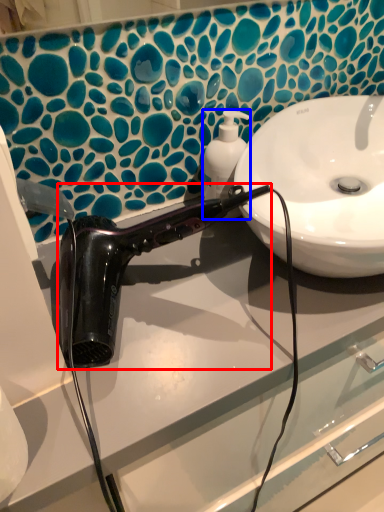
Question: Among these objects, which one is farthest to the camera, hair dryer (highlighted by a red box) or soap dispenser (highlighted by a blue box)?

Choices:
 (A) hair dryer
 (B) soap dispenser

Answer: (B)